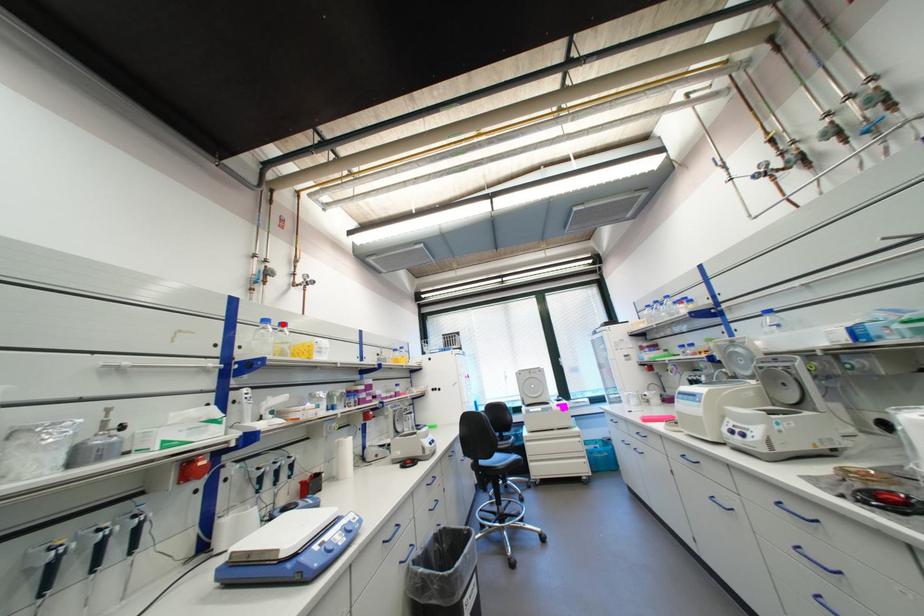
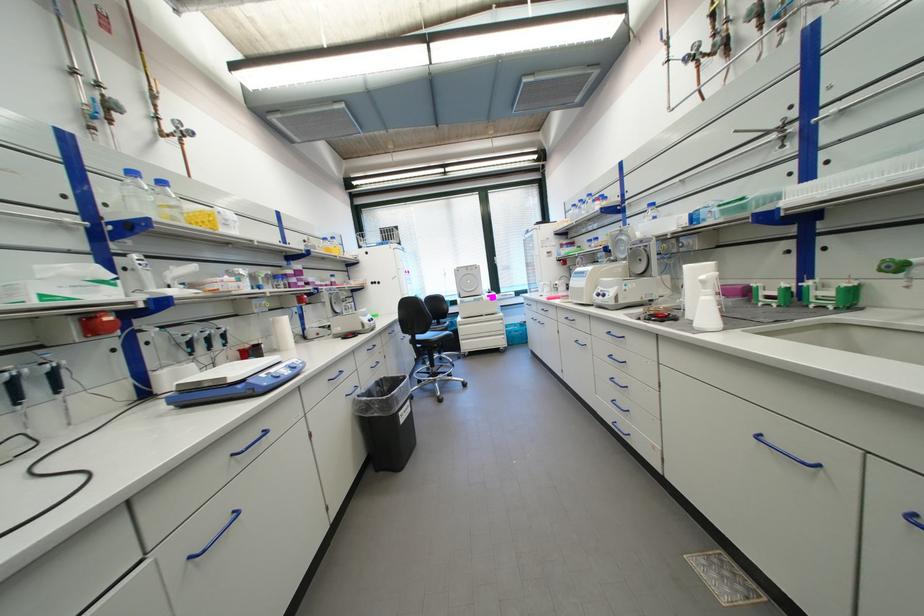
Where in the second image is the point corresponding to the highlighted location from the first image?

(156, 180)